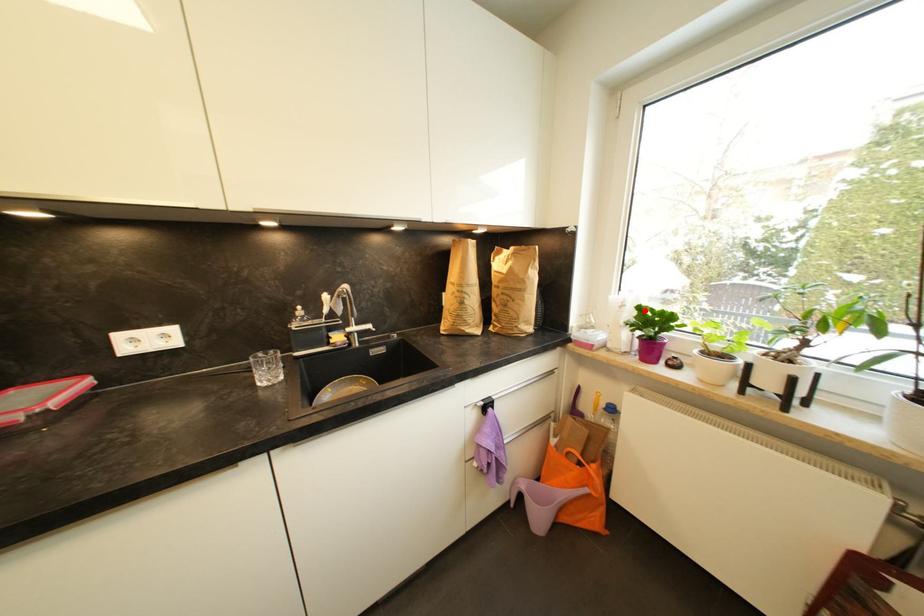
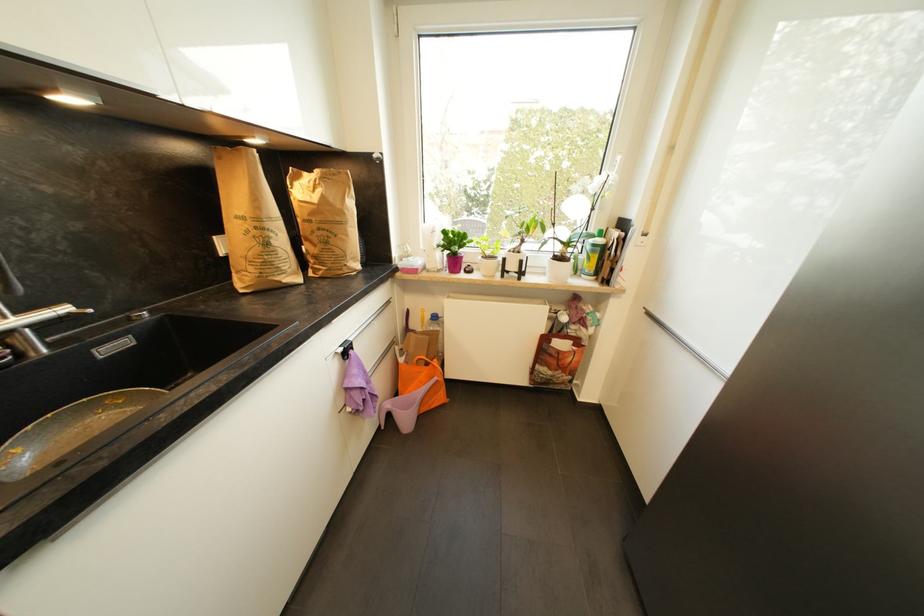
Find the pixel in the second image that matches the highlighted location in the first image.

(450, 233)